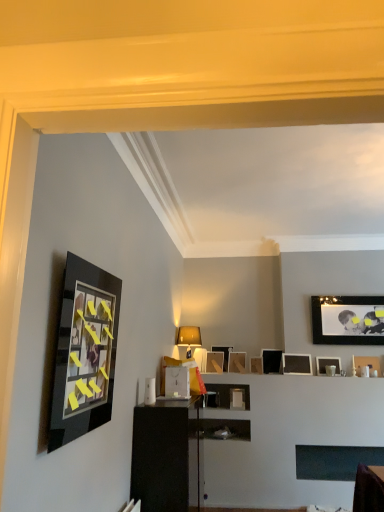
Question: Is matte black picture frame at left, the 1th picture frame positioned from the front, next to matte black picture frame at center, which is the 9th picture frame from right to left, and touching it?

Choices:
 (A) no
 (B) yes

Answer: (A)

Question: From a real-world perspective, is matte black picture frame at left, the 1th picture frame positioned from the front, beneath matte black picture frame at center, the 4th picture frame positioned from the back?

Choices:
 (A) yes
 (B) no

Answer: (B)

Question: Is matte black picture frame at left, the 10th picture frame in the right-to-left sequence, surrounding matte black picture frame at center, the 4th picture frame positioned from the back?

Choices:
 (A) yes
 (B) no

Answer: (B)

Question: Is matte black picture frame at left, the 10th picture frame in the right-to-left sequence, thinner than matte black picture frame at center, the 4th picture frame positioned from the back?

Choices:
 (A) no
 (B) yes

Answer: (B)

Question: From a real-world perspective, does matte black picture frame at left, acting as the first picture frame starting from the left, stand above matte black picture frame at center, the 7th picture frame positioned from the front?

Choices:
 (A) yes
 (B) no

Answer: (A)

Question: Does matte black picture frame at left, the 10th picture frame in the right-to-left sequence, appear on the left side of matte black picture frame at center, positioned as the second picture frame in left-to-right order?

Choices:
 (A) no
 (B) yes

Answer: (B)

Question: Is matte black picture frame at left, acting as the first picture frame starting from the left, further to camera compared to wooden picture frame at center, which is the eighth picture frame in right-to-left order?

Choices:
 (A) no
 (B) yes

Answer: (A)

Question: Does matte black picture frame at left, acting as the first picture frame starting from the left, lie in front of wooden picture frame at center, which ranks as the tenth picture frame in front-to-back order?

Choices:
 (A) yes
 (B) no

Answer: (A)

Question: From a real-world perspective, is matte black picture frame at left, the 10th picture frame from the back, positioned under wooden picture frame at center, which is the eighth picture frame in right-to-left order, based on gravity?

Choices:
 (A) no
 (B) yes

Answer: (A)

Question: Is matte black picture frame at left, the 10th picture frame in the right-to-left sequence, not close to wooden picture frame at center, which ranks as the tenth picture frame in front-to-back order?

Choices:
 (A) no
 (B) yes

Answer: (B)

Question: Can you confirm if matte black picture frame at left, acting as the first picture frame starting from the left, is thinner than wooden picture frame at center, the 1th picture frame when ordered from back to front?

Choices:
 (A) yes
 (B) no

Answer: (A)

Question: Is matte black picture frame at left, the 10th picture frame in the right-to-left sequence, taller than wooden picture frame at center, the 1th picture frame when ordered from back to front?

Choices:
 (A) yes
 (B) no

Answer: (A)

Question: Is wooden picture frame at center, which is the eighth picture frame in right-to-left order, surrounding matte black picture frame at upper right, the 5th picture frame when ordered from back to front?

Choices:
 (A) yes
 (B) no

Answer: (B)